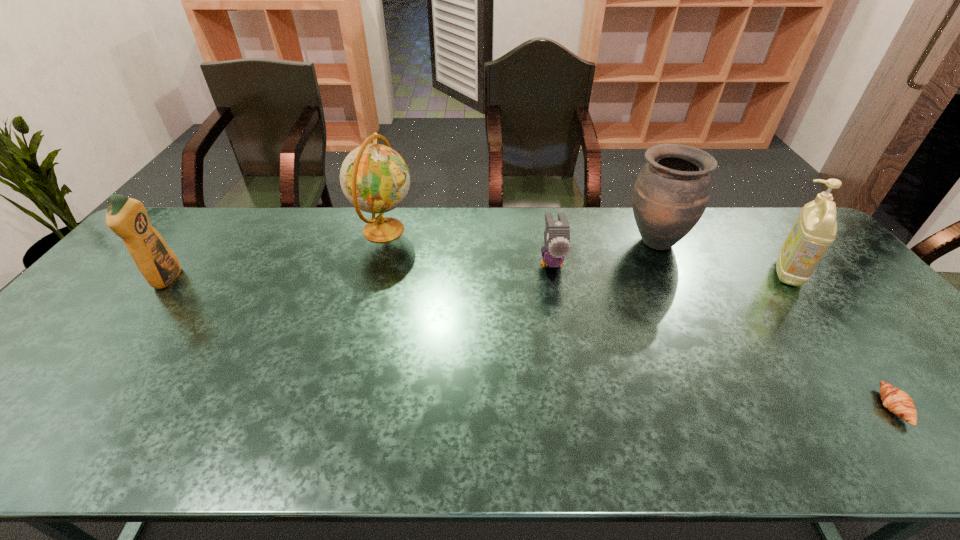
The image size is (960, 540). In order to click on free space that satisfies the following two spatial constraints: 1. on the front side of the right detergent; 2. on the right side of the globe in this screenshot , I will do `click(372, 272)`.